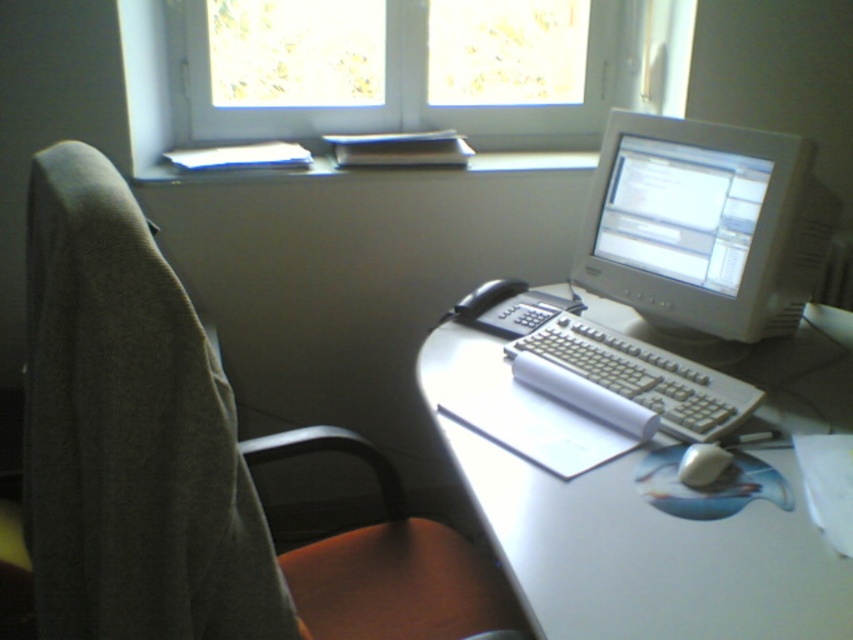
Is fabric swivel chair at left wider than white plastic keyboard at center?

In fact, fabric swivel chair at left might be narrower than white plastic keyboard at center.

Is fabric swivel chair at left to the left of white plastic keyboard at center from the viewer's perspective?

Indeed, fabric swivel chair at left is positioned on the left side of white plastic keyboard at center.

Is point (184, 474) more distant than point (677, 419)?

No, it is not.

Locate an element on the screen. fabric swivel chair at left is located at coordinates (183, 461).

Consider the image. Which of these two, fabric swivel chair at left or white glossy monitor at upper right, stands shorter?

With less height is white glossy monitor at upper right.

Is fabric swivel chair at left to the right of white glossy monitor at upper right from the viewer's perspective?

Incorrect, fabric swivel chair at left is not on the right side of white glossy monitor at upper right.

What do you see at coordinates (183, 461) in the screenshot? I see `fabric swivel chair at left` at bounding box center [183, 461].

Where is `fabric swivel chair at left`? The height and width of the screenshot is (640, 853). fabric swivel chair at left is located at coordinates click(183, 461).

Between point (520, 397) and point (135, 164), which one is positioned in front?

Positioned in front is point (520, 397).

Does white plastic computer desk at center have a greater width compared to transparent glass window at upper center?

Yes.

This screenshot has height=640, width=853. What do you see at coordinates (624, 518) in the screenshot?
I see `white plastic computer desk at center` at bounding box center [624, 518].

Locate an element on the screen. white plastic computer desk at center is located at coordinates (624, 518).